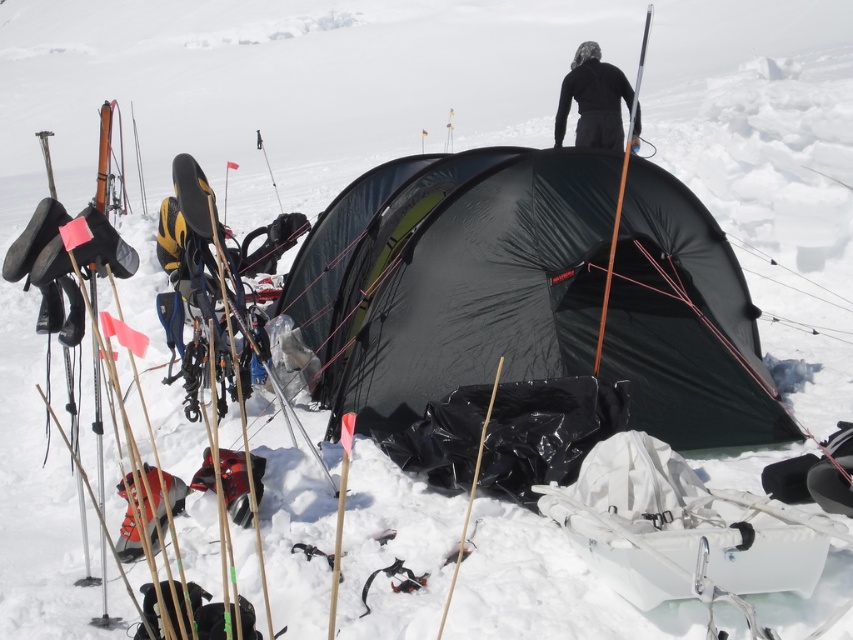
Question: Among these objects, which one is farthest from the camera?

Choices:
 (A) black tarpaulin tent at center
 (B) black matte jacket at upper center

Answer: (B)

Question: Which object appears farthest from the camera in this image?

Choices:
 (A) black tarpaulin tent at center
 (B) black matte jacket at upper center

Answer: (B)

Question: Is the position of black tarpaulin tent at center more distant than that of black matte jacket at upper center?

Choices:
 (A) yes
 (B) no

Answer: (B)

Question: Is black tarpaulin tent at center positioned in front of black matte jacket at upper center?

Choices:
 (A) no
 (B) yes

Answer: (B)

Question: Is black tarpaulin tent at center below black matte jacket at upper center?

Choices:
 (A) yes
 (B) no

Answer: (A)